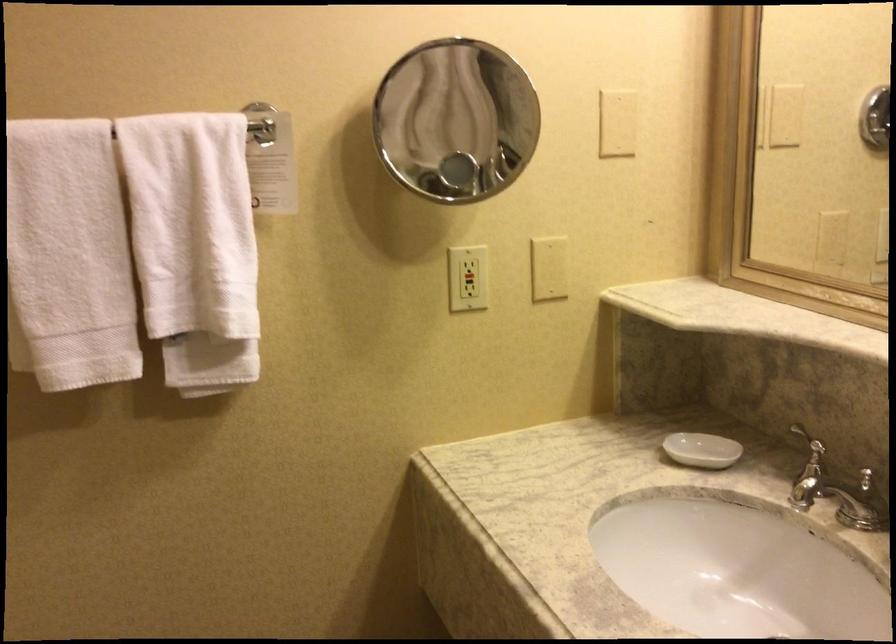
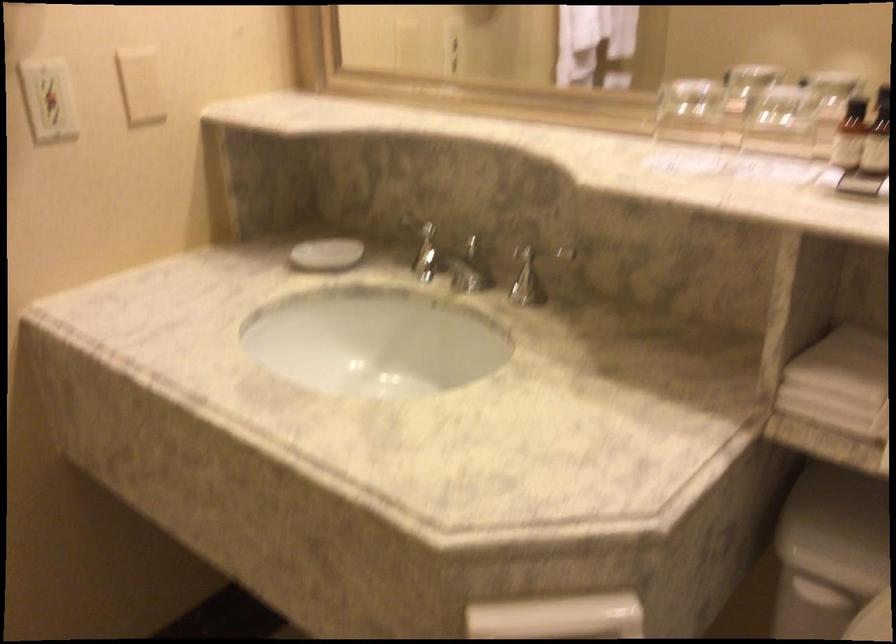
Locate, in the second image, the point that corresponds to pixel 703 446 in the first image.

(325, 254)